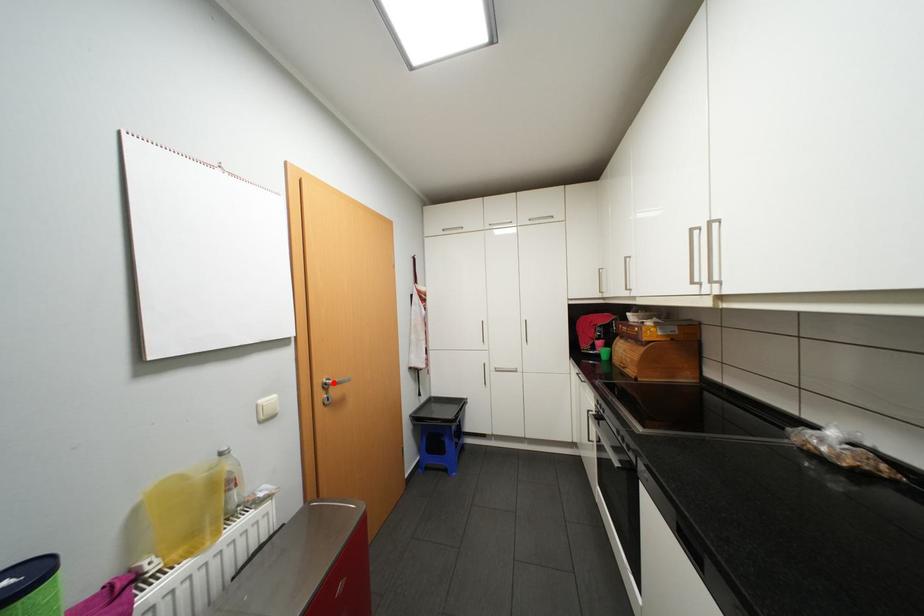
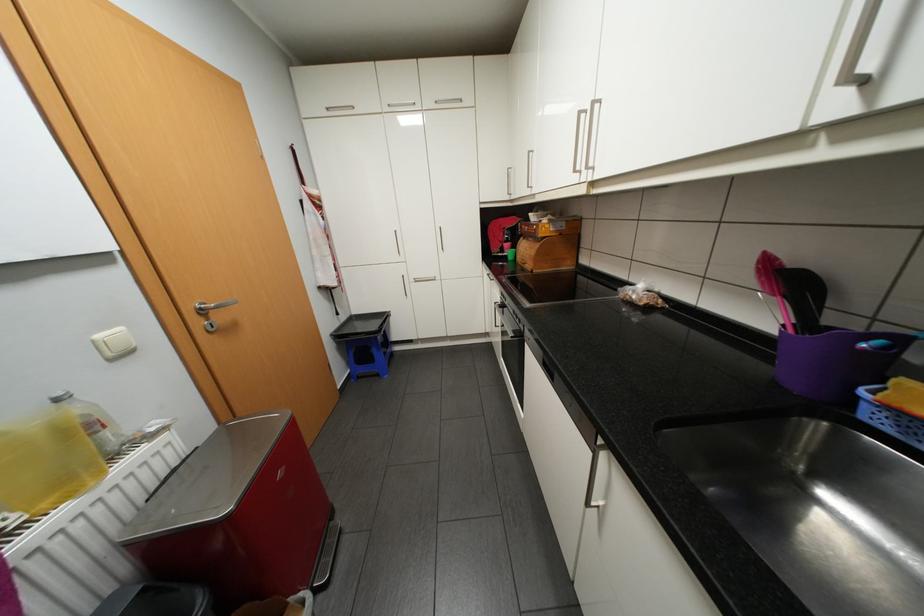
Find the pixel in the second image that matches the highlighted location in the first image.

(209, 308)